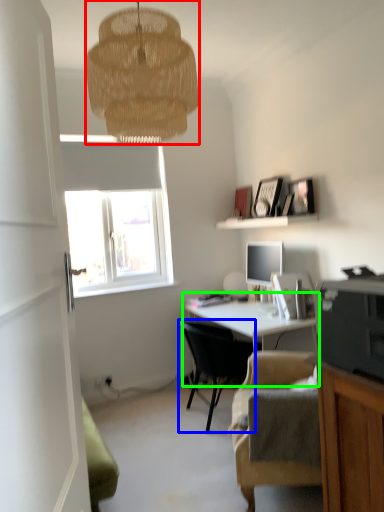
Question: Considering the real-world distances, which object is closest to lamp (highlighted by a red box)? chair (highlighted by a blue box) or desk (highlighted by a green box).

Choices:
 (A) chair
 (B) desk

Answer: (B)